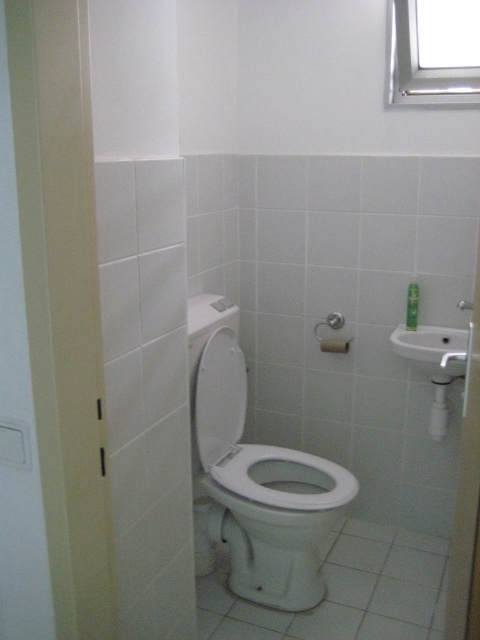
Question: Is the position of white glossy toilet at center less distant than that of white matte toilet paper at center?

Choices:
 (A) yes
 (B) no

Answer: (A)

Question: Does white ceramic sink at right have a greater width compared to white matte toilet paper at center?

Choices:
 (A) yes
 (B) no

Answer: (A)

Question: Which object is the farthest from the matte white shower at center?

Choices:
 (A) white matte toilet paper at center
 (B) white glossy toilet at center

Answer: (B)

Question: Which point is farther to the camera?

Choices:
 (A) (202, 353)
 (B) (335, 316)
 (C) (319, 474)

Answer: (B)

Question: Is white ceramic sink at right to the left of white matte toilet paper at center from the viewer's perspective?

Choices:
 (A) yes
 (B) no

Answer: (B)

Question: Which of the following is the closest to the observer?

Choices:
 (A) (227, 378)
 (B) (262, 528)

Answer: (B)